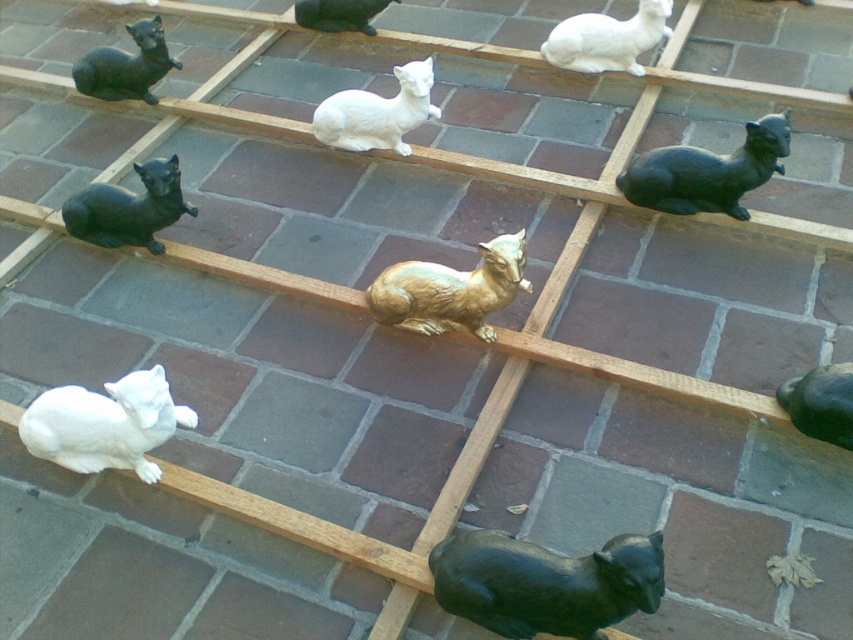
Question: Which of the following is the closest to the observer?

Choices:
 (A) shiny black goat at lower right
 (B) gold metallic goat at center
 (C) white glossy goat at center

Answer: (A)

Question: Does gold metallic goat at center have a larger size compared to shiny black goat at lower right?

Choices:
 (A) no
 (B) yes

Answer: (B)

Question: Can you confirm if black glossy cat at lower right is smaller than shiny black cat at upper left?

Choices:
 (A) yes
 (B) no

Answer: (B)

Question: Which of the following is the farthest from the observer?

Choices:
 (A) matte black cat at upper center
 (B) matte black cat at upper left
 (C) shiny black cat at upper left
 (D) shiny black goat at lower right

Answer: (A)

Question: Is matte black cat at upper right smaller than shiny black cat at upper left?

Choices:
 (A) no
 (B) yes

Answer: (A)

Question: Which point is farther to the camera?

Choices:
 (A) (827, 429)
 (B) (582, 58)

Answer: (B)